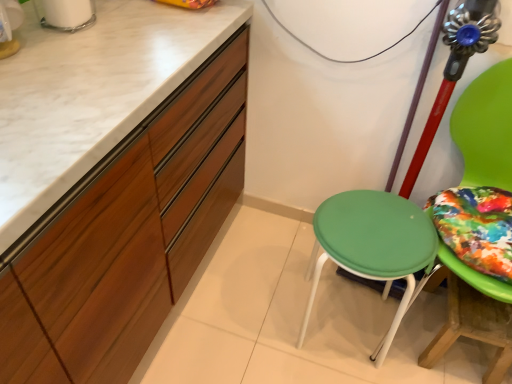
Find the location of a particular element. The width and height of the screenshot is (512, 384). vacant area on top of green plastic stool at center (from a real-world perspective) is located at coordinates (384, 232).